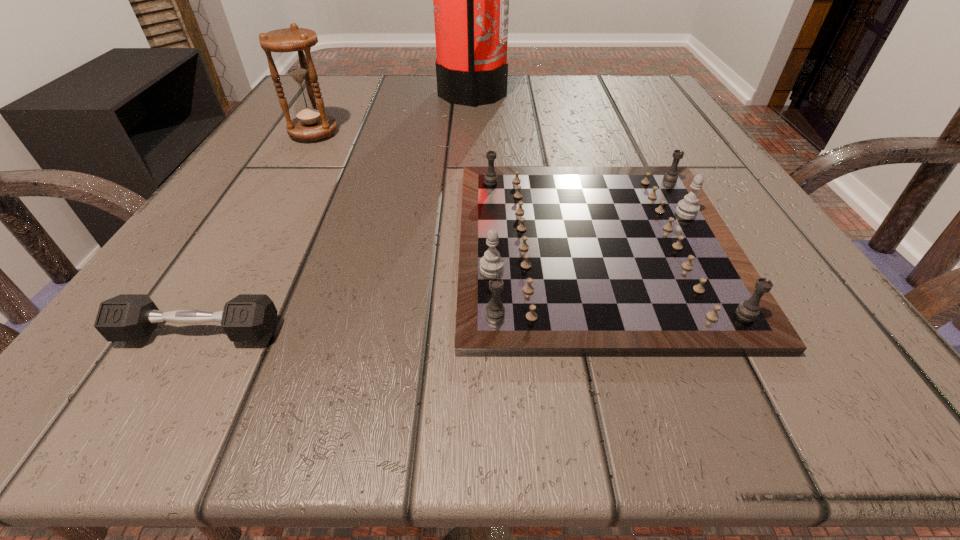
The height and width of the screenshot is (540, 960). I want to click on free space located on the board of the second shortest object, so click(304, 246).

Identify the location of free space located on the right of the dumbbell. (382, 332).

Image resolution: width=960 pixels, height=540 pixels. I want to click on object present at the far edge, so click(x=471, y=0).

Find the location of a particular element. This screenshot has width=960, height=540. chessboard situated at the near edge is located at coordinates (554, 261).

Identify the location of dumbbell at the near edge. (127, 317).

Identify the location of hourglass positioned at the left edge. (294, 44).

Find the location of a particular element. The height and width of the screenshot is (540, 960). dumbbell present at the left edge is located at coordinates (127, 317).

You are a GUI agent. You are given a task and a screenshot of the screen. Output one action in this format:
    pyautogui.click(x=<x>, y=<y>)
    Task: Click on the object that is at the right edge
    
    Given the screenshot: What is the action you would take?
    pyautogui.click(x=554, y=261)

This screenshot has width=960, height=540. Find the location of `object present at the near left corner`. object present at the near left corner is located at coordinates (127, 317).

Locate an element on the screen. object present at the near right corner is located at coordinates (554, 261).